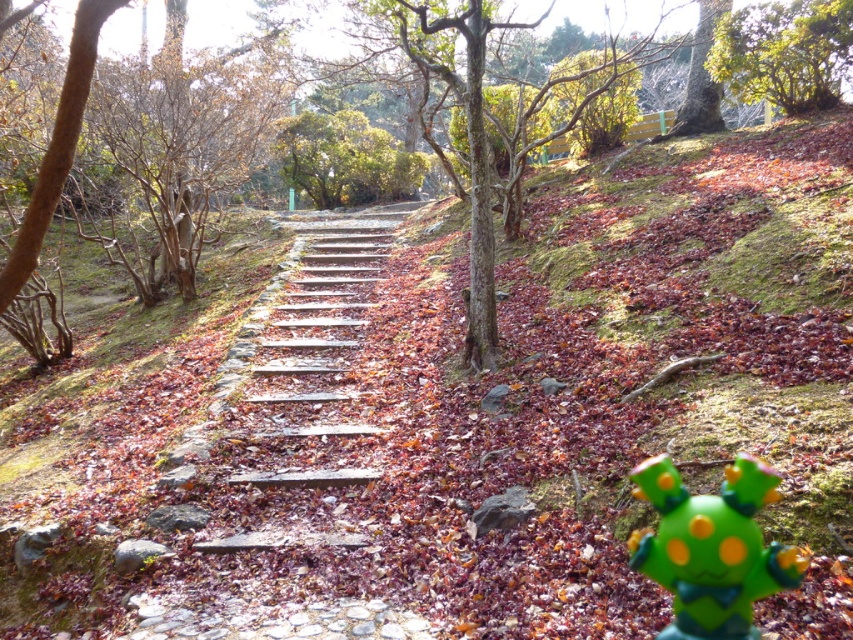
Which of these two, wooden steps at center or green matte toy at lower right, stands taller?

wooden steps at center is taller.

Does wooden steps at center appear over green matte toy at lower right?

Correct, wooden steps at center is located above green matte toy at lower right.

You are a GUI agent. You are given a task and a screenshot of the screen. Output one action in this format:
    pyautogui.click(x=<x>, y=<y>)
    Task: Click on the wooden steps at center
    
    Given the screenshot: What is the action you would take?
    pyautogui.click(x=296, y=392)

Who is shorter, green leafy tree at upper right or green leafy tree at center?

green leafy tree at upper right

Locate an element on the screen. This screenshot has width=853, height=640. green leafy tree at upper right is located at coordinates (784, 52).

Locate an element on the screen. Image resolution: width=853 pixels, height=640 pixels. green leafy tree at upper right is located at coordinates pos(784,52).

Is wooden steps at center positioned behind green leafy tree at upper right?

That is False.

Does point (289, 456) come farther from viewer compared to point (805, 96)?

No, it is in front of (805, 96).

Where is `wooden steps at center`? Image resolution: width=853 pixels, height=640 pixels. wooden steps at center is located at coordinates (296, 392).